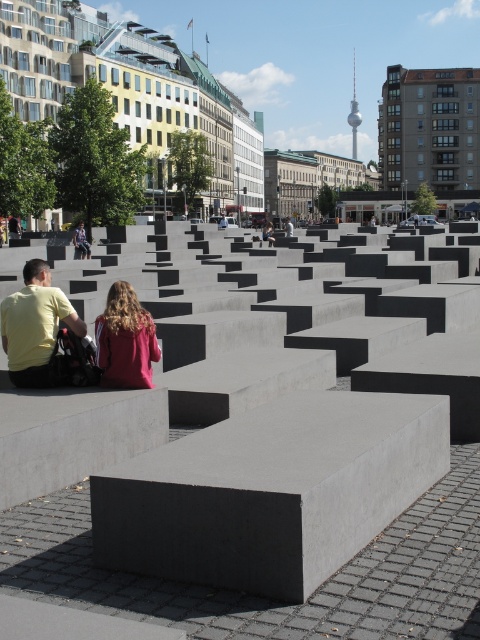
Question: Which point appears farthest from the camera in this image?

Choices:
 (A) (38, 320)
 (B) (134, 307)

Answer: (A)

Question: Which point appears closest to the camera in this image?

Choices:
 (A) (44, 262)
 (B) (159, 356)
 (C) (12, 218)
 (D) (79, 243)

Answer: (B)

Question: Is yellow matte shirt at lower left to the left of maroon fabric hair at center from the viewer's perspective?

Choices:
 (A) yes
 (B) no

Answer: (A)

Question: Does smooth gray concrete at center have a smaller size compared to matte gray bench at lower left?

Choices:
 (A) yes
 (B) no

Answer: (B)

Question: Can you confirm if yellow matte shirt at lower left is positioned below maroon fabric hair at center?

Choices:
 (A) yes
 (B) no

Answer: (A)

Question: Which point is closer to the camera taking this photo?

Choices:
 (A) (22, 316)
 (B) (82, 221)
 (C) (14, 230)
 (D) (139, 378)

Answer: (D)